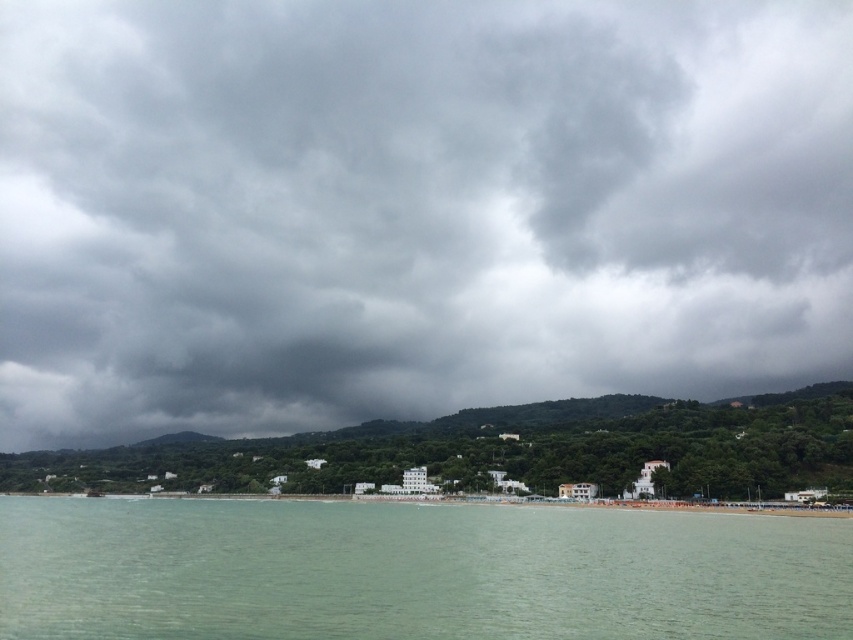
You are standing on the beach and looking towards the horizon. Which object, the dark gray cloud at upper center or the clear water at lower center, is positioned higher in the sky?

The dark gray cloud at upper center is positioned higher in the sky than the clear water at lower center because it is located above it according to the description.

You are standing at the beach looking towards the hills. There are two points marked in the image. The first point is at coordinates point (849, 92) and the second is at point (170, 541). Which point is closer to you?

Point (849, 92) is further to the viewer than point (170, 541), so the point closer to you is point (170, 541).

You are standing on the beach looking towards the horizon. You see the dark gray cloud at upper center and the clear water at lower center. Which object is closer to you?

The clear water at lower center is closer to you because it is positioned behind the dark gray cloud at upper center, meaning the cloud is in front of it.